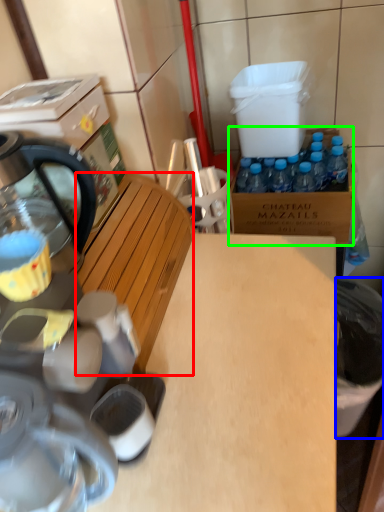
Question: Based on their relative distances, which object is farther from wood (highlighted by a red box)? Choose from trash bin/can (highlighted by a blue box) and cardboard box (highlighted by a green box).

Choices:
 (A) trash bin/can
 (B) cardboard box

Answer: (B)